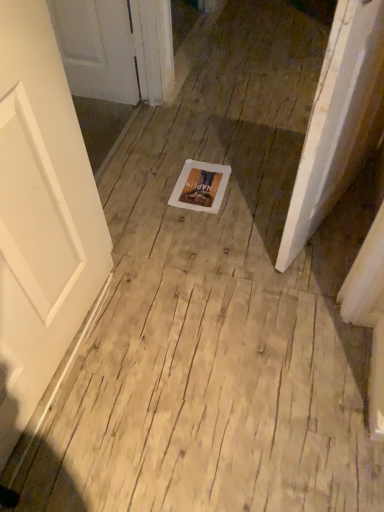
At what (x,y) coordinates should I click in order to perform the action: click on white paper at center. Please return your answer as a coordinate pair (x, y). Image resolution: width=384 pixels, height=512 pixels. Looking at the image, I should click on (200, 186).

The image size is (384, 512). What do you see at coordinates (200, 186) in the screenshot? I see `white paper at center` at bounding box center [200, 186].

What is the approximate height of light brown wood floor at center?

The height of light brown wood floor at center is 1.25 inches.

You are a GUI agent. You are given a task and a screenshot of the screen. Output one action in this format:
    pyautogui.click(x=<x>, y=<y>)
    Task: Click on the light brown wood floor at center
    
    Given the screenshot: What is the action you would take?
    pyautogui.click(x=207, y=404)

In order to face light brown wood floor at center, should I rotate leftwards or rightwards?

Rotate your view right by about 1.843°.

Describe the element at coordinates (207, 404) in the screenshot. I see `light brown wood floor at center` at that location.

Find the location of a particular element. The height and width of the screenshot is (512, 384). white paper at center is located at coordinates (200, 186).

Can you confirm if white paper at center is positioned to the right of light brown wood floor at center?

In fact, white paper at center is to the left of light brown wood floor at center.

Which is in front, white paper at center or light brown wood floor at center?

light brown wood floor at center is more forward.

Which point is more forward, (204, 209) or (291, 461)?

The point (291, 461) is in front.

From the image's perspective, is white paper at center above or below light brown wood floor at center?

Based on their image positions, white paper at center is located above light brown wood floor at center.

From a real-world perspective, between white paper at center and light brown wood floor at center, who is vertically higher?

white paper at center, from a real-world perspective.

In the scene shown: Considering the relative sizes of white paper at center and light brown wood floor at center in the image provided, is white paper at center wider than light brown wood floor at center?

In fact, white paper at center might be narrower than light brown wood floor at center.

Which of these two, white paper at center or light brown wood floor at center, stands shorter?

With less height is white paper at center.

Can you confirm if white paper at center is bigger than light brown wood floor at center?

Actually, white paper at center might be smaller than light brown wood floor at center.

Is light brown wood floor at center surrounded by white paper at center?

That's incorrect, light brown wood floor at center is not inside white paper at center.

Is white paper at center next to light brown wood floor at center and touching it?

white paper at center and light brown wood floor at center are clearly separated.

Is white paper at center oriented away from light brown wood floor at center?

No, light brown wood floor at center is not at the back of white paper at center.

The image size is (384, 512). I want to click on plywood on the right of white paper at center, so click(x=207, y=404).

Considering the relative positions of light brown wood floor at center and white paper at center in the image provided, is light brown wood floor at center to the left of white paper at center from the viewer's perspective?

No, light brown wood floor at center is not to the left of white paper at center.

In the scene shown: Considering their positions, is light brown wood floor at center located in front of or behind white paper at center?

Visually, light brown wood floor at center is located in front of white paper at center.

Considering the points (338, 333) and (212, 176), which point is behind, point (338, 333) or point (212, 176)?

The point (212, 176) is farther from the camera.

From the image's perspective, is light brown wood floor at center located above white paper at center?

No.

From a real-world perspective, who is located lower, light brown wood floor at center or white paper at center?

light brown wood floor at center, from a real-world perspective.

Considering the relative sizes of light brown wood floor at center and white paper at center in the image provided, is light brown wood floor at center thinner than white paper at center?

In fact, light brown wood floor at center might be wider than white paper at center.

Between light brown wood floor at center and white paper at center, which one has less height?

white paper at center is shorter.

Is light brown wood floor at center smaller than white paper at center?

Actually, light brown wood floor at center might be larger than white paper at center.

Is light brown wood floor at center not inside white paper at center?

Yes, light brown wood floor at center is not within white paper at center.

Based on the photo, is light brown wood floor at center not near white paper at center?

That's not correct — light brown wood floor at center is a little close to white paper at center.

Is light brown wood floor at center oriented towards white paper at center?

→ Yes.

Can you tell me how much light brown wood floor at center and white paper at center differ in facing direction?

The facing directions of light brown wood floor at center and white paper at center are 180 degrees apart.

In the scene shown: Measure the distance between light brown wood floor at center and white paper at center.

light brown wood floor at center and white paper at center are 28.74 inches apart from each other.

I want to click on plywood in front of the white paper at center, so click(x=207, y=404).

Find the location of `plywood that is below the white paper at center (from the image's perspective)`. plywood that is below the white paper at center (from the image's perspective) is located at coordinates (207, 404).

Locate an element on the screen. postcard behind the light brown wood floor at center is located at coordinates (200, 186).